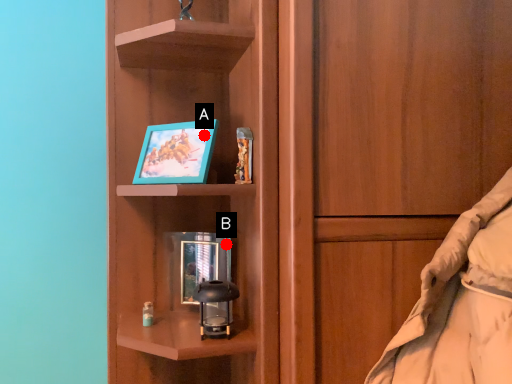
Question: Two points are circled on the image, labeled by A and B beside each circle. Which point is farther to the camera?

Choices:
 (A) A is further
 (B) B is further

Answer: (B)